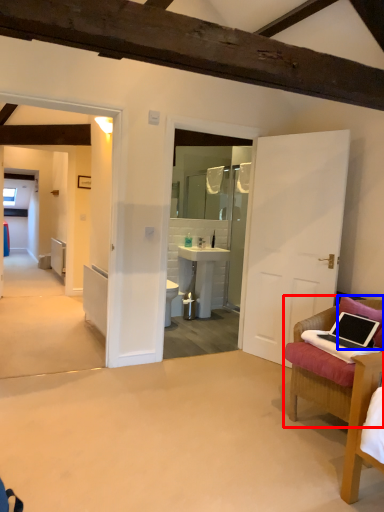
Question: Which point is further to the camera, chair (highlighted by a red box) or pillow (highlighted by a blue box)?

Choices:
 (A) chair
 (B) pillow

Answer: (B)